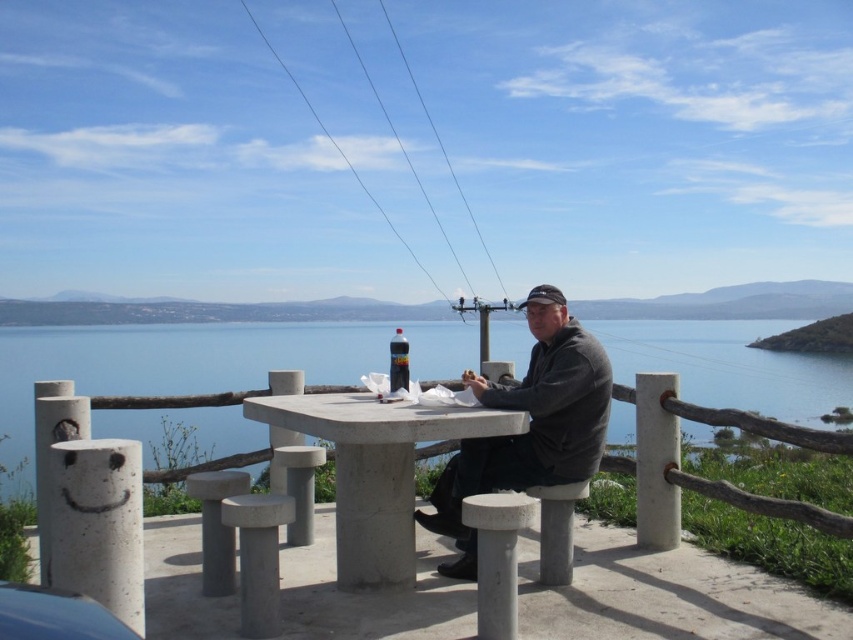
Question: Which of these objects is positioned farthest from the concrete at center?

Choices:
 (A) dark gray sweater at center
 (B) concrete/stone stool at lower center

Answer: (B)

Question: Which object appears closest to the camera in this image?

Choices:
 (A) gray concrete stool at center
 (B) concrete stool at lower center
 (C) dark gray sweater at center

Answer: (C)

Question: Is concrete at center further to camera compared to gray concrete stool at center?

Choices:
 (A) no
 (B) yes

Answer: (A)

Question: From the image, what is the correct spatial relationship of concrete at center in relation to gray concrete stool at lower center?

Choices:
 (A) left
 (B) right

Answer: (A)

Question: Which of the following is the closest to the observer?

Choices:
 (A) (393, 355)
 (B) (581, 346)
 (C) (297, 497)
 (D) (548, 524)

Answer: (B)

Question: Is white concrete stool at lower center below transparent plastic bottle at center?

Choices:
 (A) no
 (B) yes

Answer: (B)